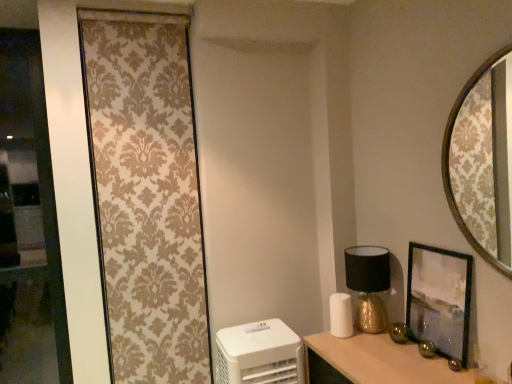
Question: From a real-world perspective, does wooden frame mirror at upper right stand above matte black picture frame at right?

Choices:
 (A) no
 (B) yes

Answer: (B)

Question: Is wooden frame mirror at upper right looking in the opposite direction of matte black picture frame at right?

Choices:
 (A) no
 (B) yes

Answer: (A)

Question: Considering the relative sizes of wooden frame mirror at upper right and matte black picture frame at right in the image provided, is wooden frame mirror at upper right shorter than matte black picture frame at right?

Choices:
 (A) no
 (B) yes

Answer: (A)

Question: Is wooden frame mirror at upper right at the left side of matte black picture frame at right?

Choices:
 (A) no
 (B) yes

Answer: (A)

Question: Is wooden frame mirror at upper right positioned in front of matte black picture frame at right?

Choices:
 (A) yes
 (B) no

Answer: (A)

Question: From the image's perspective, is wooden frame mirror at upper right under matte black picture frame at right?

Choices:
 (A) yes
 (B) no

Answer: (B)

Question: Is white plastic air purifier at lower left positioned beyond the bounds of wooden frame mirror at upper right?

Choices:
 (A) no
 (B) yes

Answer: (B)

Question: From a real-world perspective, is white plastic air purifier at lower left beneath wooden frame mirror at upper right?

Choices:
 (A) yes
 (B) no

Answer: (A)

Question: Is white plastic air purifier at lower left positioned with its back to wooden frame mirror at upper right?

Choices:
 (A) no
 (B) yes

Answer: (A)

Question: Is white plastic air purifier at lower left oriented towards wooden frame mirror at upper right?

Choices:
 (A) no
 (B) yes

Answer: (A)

Question: Is white plastic air purifier at lower left far away from wooden frame mirror at upper right?

Choices:
 (A) yes
 (B) no

Answer: (A)

Question: Can you confirm if white plastic air purifier at lower left is bigger than wooden frame mirror at upper right?

Choices:
 (A) no
 (B) yes

Answer: (B)

Question: Does white plastic air purifier at lower left have a lesser height compared to beige damask curtain at left?

Choices:
 (A) no
 (B) yes

Answer: (B)